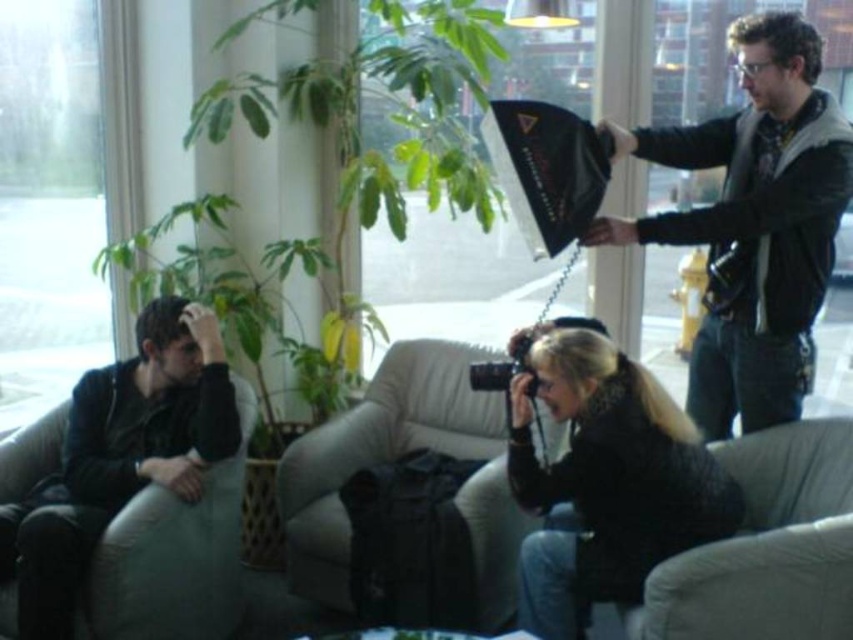
You are trying to decide where to place a new lamp in the living room. The lamp needs to be positioned to the right of the black leather jacket at left but still within the same general area as the beige fabric couch at center. Based on the current arrangement, is there enough space to place the lamp in that location?

The black leather jacket at left is to the left of the beige fabric couch at center, so there is space to the right of the black leather jacket at left and within the area of the beige fabric couch at center. The lamp can be placed there.

You are a photographer in the scene and want to move closer to the gray fabric armchair at lower right without blocking the camera operator. Which direction should you move from your current position at the green leafy plant at center?

Since the green leafy plant at center is to the left of the gray fabric armchair at lower right, you should move to the right to reach the gray fabric armchair at lower right while avoiding blocking the camera operator.

Based on the photo, you are a photographer standing at the camera position in the scene. You want to ensure that the green leafy plant at center is in focus while capturing the main subject on the sofa. Since the camera has a depth of field of 1.5 meters, will the plant be in focus if you focus on the main subject?

The green leafy plant at center is 2.88 meters away from the camera. If the depth of field is 1.5 meters, the area in focus would extend from 1.5 meters behind to 1.5 meters in front of the focused point. However, since the plant is further away than the depth of field range, it would likely be out of focus if the main subject on the sofa is within the depth of field range. Wait, but we donot know the distance of the main subject. Hmm, maybe the question is designed to assume that the main subject is at the